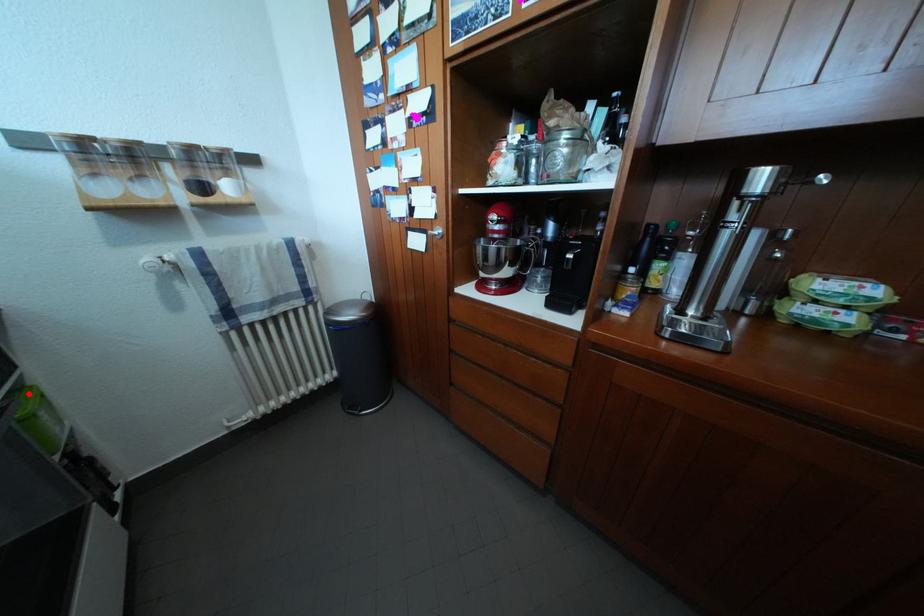
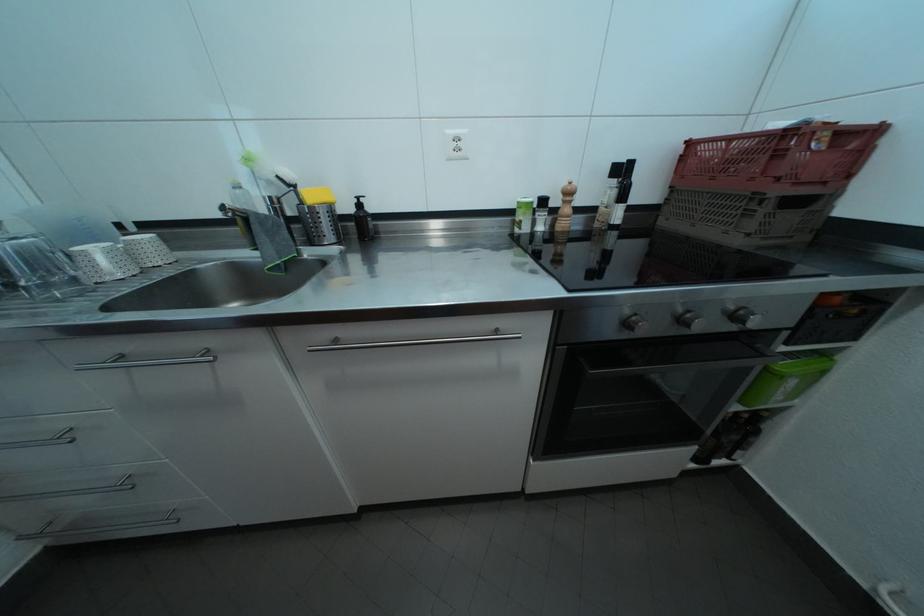
Find the pixel in the second image that matches the highlighted location in the first image.

(833, 360)